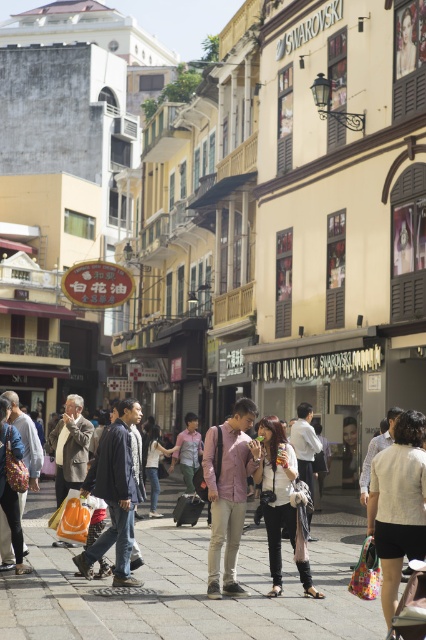
Which is more to the right, white textured shirt at center or pink fabric shirt at center?

white textured shirt at center

Image resolution: width=426 pixels, height=640 pixels. What are the coordinates of `white textured shirt at center` in the screenshot? It's located at (397, 502).

Does white textured shirt at center have a lesser width compared to matte black jacket at center?

Yes.

Who is taller, white textured shirt at center or matte black jacket at center?

matte black jacket at center is taller.

At what (x,y) coordinates should I click in order to perform the action: click on white textured shirt at center. Please return your answer as a coordinate pair (x, y). This screenshot has height=640, width=426. Looking at the image, I should click on (397, 502).

How far apart are pink fabric shirt at center and light pink fabric shirt at center?

The distance of pink fabric shirt at center from light pink fabric shirt at center is 45.73 feet.

Does pink fabric shirt at center appear on the right side of light pink fabric shirt at center?

Indeed, pink fabric shirt at center is positioned on the right side of light pink fabric shirt at center.

What are the coordinates of `pink fabric shirt at center` in the screenshot? It's located at click(229, 492).